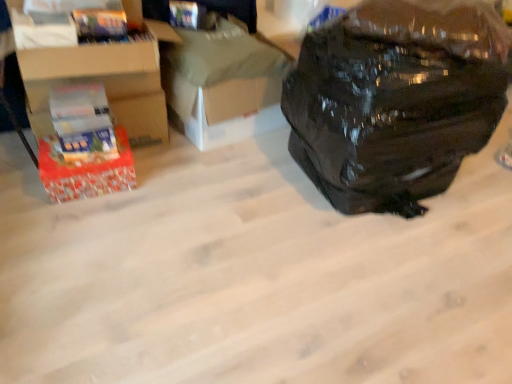
Identify the location of free spot to the left of black matte backpack at right. (232, 198).